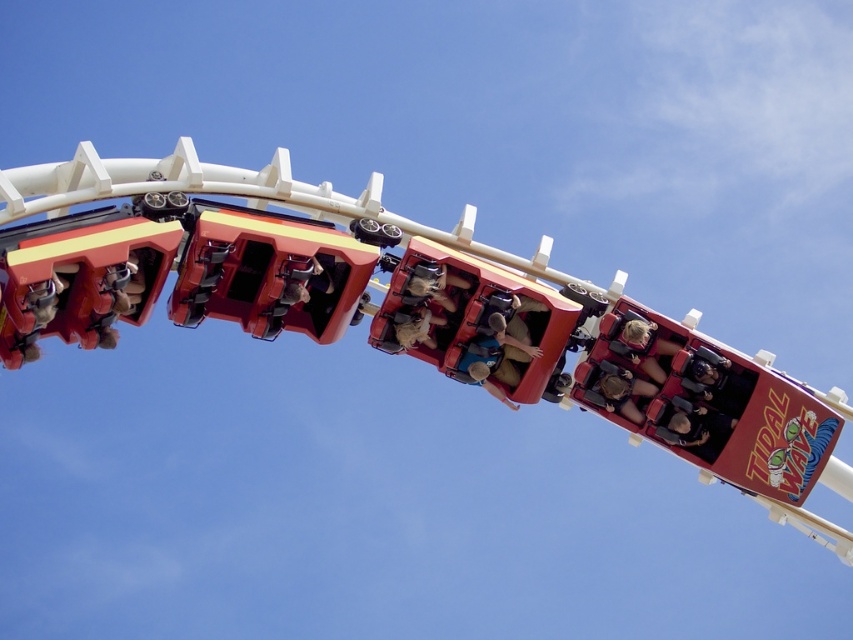
Does brown leather jacket at center appear on the left side of matte black helmet at lower right?

Correct, you'll find brown leather jacket at center to the left of matte black helmet at lower right.

Looking at this image, who is higher up, brown leather jacket at center or matte black helmet at lower right?

Positioned higher is brown leather jacket at center.

Where is `brown leather jacket at center`? The width and height of the screenshot is (853, 640). brown leather jacket at center is located at coordinates (515, 342).

Image resolution: width=853 pixels, height=640 pixels. I want to click on brown leather jacket at center, so click(x=515, y=342).

Between metallic red roller coaster car at center and matte brown hair at center, which one is positioned higher?

Positioned higher is metallic red roller coaster car at center.

Where is `metallic red roller coaster car at center`? The image size is (853, 640). metallic red roller coaster car at center is located at coordinates (358, 296).

The width and height of the screenshot is (853, 640). Describe the element at coordinates (358, 296) in the screenshot. I see `metallic red roller coaster car at center` at that location.

Where is `metallic red roller coaster car at center`? metallic red roller coaster car at center is located at coordinates (358, 296).

Is brown leather jacket at center to the left of matte brown hair at center from the viewer's perspective?

Correct, you'll find brown leather jacket at center to the left of matte brown hair at center.

Can you confirm if brown leather jacket at center is taller than matte brown hair at center?

Incorrect, brown leather jacket at center's height is not larger of matte brown hair at center's.

You are a GUI agent. You are given a task and a screenshot of the screen. Output one action in this format:
    pyautogui.click(x=<x>, y=<y>)
    Task: Click on the brown leather jacket at center
    
    Given the screenshot: What is the action you would take?
    pyautogui.click(x=515, y=342)